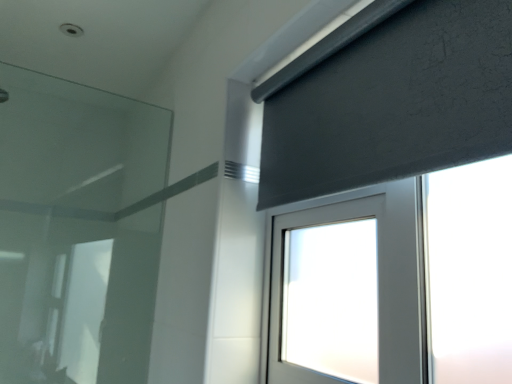
Describe the element at coordinates (389, 99) in the screenshot. I see `dark gray textured curtain at upper right` at that location.

Where is `dark gray textured curtain at upper right`? The width and height of the screenshot is (512, 384). dark gray textured curtain at upper right is located at coordinates (389, 99).

What is the approximate height of dark gray textured curtain at upper right?

It is 15.55 inches.

At what (x,y) coordinates should I click in order to perform the action: click on transparent glass at left. Please return your answer as a coordinate pair (x, y). Looking at the image, I should click on (77, 230).

What do you see at coordinates (77, 230) in the screenshot? This screenshot has height=384, width=512. I see `transparent glass at left` at bounding box center [77, 230].

Image resolution: width=512 pixels, height=384 pixels. In order to click on dark gray textured curtain at upper right in this screenshot , I will do `click(389, 99)`.

Is transparent glass at left to the left of dark gray textured curtain at upper right from the viewer's perspective?

Correct, you'll find transparent glass at left to the left of dark gray textured curtain at upper right.

Which object is further away from the camera taking this photo, transparent glass at left or dark gray textured curtain at upper right?

transparent glass at left.

Looking at this image, which point is more forward, [28,291] or [381,104]?

Positioned in front is point [381,104].

From the image's perspective, is transparent glass at left below dark gray textured curtain at upper right?

Yes, from the image's perspective, transparent glass at left is below dark gray textured curtain at upper right.

From a real-world perspective, which is physically below, transparent glass at left or dark gray textured curtain at upper right?

transparent glass at left is physically lower.

Is transparent glass at left thinner than dark gray textured curtain at upper right?

Indeed, transparent glass at left has a lesser width compared to dark gray textured curtain at upper right.

Who is taller, transparent glass at left or dark gray textured curtain at upper right?

Standing taller between the two is transparent glass at left.

Does transparent glass at left have a larger size compared to dark gray textured curtain at upper right?

Yes.

Is transparent glass at left located outside dark gray textured curtain at upper right?

Absolutely, transparent glass at left is external to dark gray textured curtain at upper right.

Is transparent glass at left not near dark gray textured curtain at upper right?

Yes, transparent glass at left and dark gray textured curtain at upper right are located far from each other.

Is transparent glass at left positioned with its back to dark gray textured curtain at upper right?

transparent glass at left is not turned away from dark gray textured curtain at upper right.

Can you tell me how much transparent glass at left and dark gray textured curtain at upper right differ in facing direction?

91.2 degrees separate the facing orientations of transparent glass at left and dark gray textured curtain at upper right.

Find the location of a particular element. The image size is (512, 384). filter on the left of dark gray textured curtain at upper right is located at coordinates (77, 230).

In the image, is dark gray textured curtain at upper right on the left side or the right side of transparent glass at left?

In the image, dark gray textured curtain at upper right appears on the right side of transparent glass at left.

Which object is more forward, dark gray textured curtain at upper right or transparent glass at left?

Positioned in front is dark gray textured curtain at upper right.

Considering the points (297, 58) and (29, 235), which point is behind, point (297, 58) or point (29, 235)?

The point (29, 235) is behind.

From the image's perspective, which one is positioned higher, dark gray textured curtain at upper right or transparent glass at left?

dark gray textured curtain at upper right is shown above in the image.

From a real-world perspective, relative to transparent glass at left, is dark gray textured curtain at upper right vertically above or below?

Clearly, from a real-world perspective, dark gray textured curtain at upper right is above transparent glass at left.

Considering the relative sizes of dark gray textured curtain at upper right and transparent glass at left in the image provided, is dark gray textured curtain at upper right wider than transparent glass at left?

Yes, dark gray textured curtain at upper right is wider than transparent glass at left.

In the scene shown: Which of these two, dark gray textured curtain at upper right or transparent glass at left, stands taller?

With more height is transparent glass at left.

Considering the relative sizes of dark gray textured curtain at upper right and transparent glass at left in the image provided, is dark gray textured curtain at upper right bigger than transparent glass at left?

No, dark gray textured curtain at upper right is not bigger than transparent glass at left.

Based on the photo, would you say dark gray textured curtain at upper right is outside transparent glass at left?

dark gray textured curtain at upper right lies outside transparent glass at left's area.

Is dark gray textured curtain at upper right positioned far away from transparent glass at left?

Yes.

Could you tell me if dark gray textured curtain at upper right is facing transparent glass at left?

No, dark gray textured curtain at upper right is not oriented towards transparent glass at left.

You are a GUI agent. You are given a task and a screenshot of the screen. Output one action in this format:
    pyautogui.click(x=<x>, y=<y>)
    Task: Click on the filter located below the dark gray textured curtain at upper right (from the image's perspective)
    
    Given the screenshot: What is the action you would take?
    pyautogui.click(x=77, y=230)

Image resolution: width=512 pixels, height=384 pixels. Find the location of `filter on the left side of dark gray textured curtain at upper right`. filter on the left side of dark gray textured curtain at upper right is located at coordinates (77, 230).

This screenshot has width=512, height=384. I want to click on filter located underneath the dark gray textured curtain at upper right (from a real-world perspective), so click(x=77, y=230).